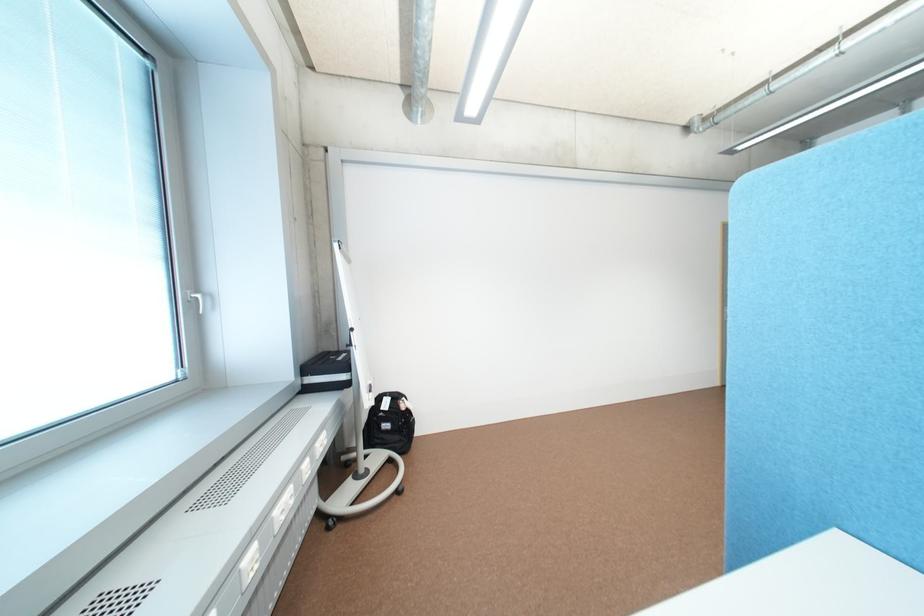
In order to click on black backpack in this screenshot , I will do `click(388, 424)`.